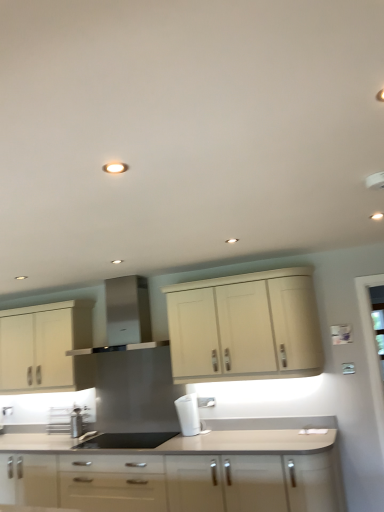
Question: Is black matte sink at center bigger than metallic stainless steel spice rack at lower left?

Choices:
 (A) no
 (B) yes

Answer: (B)

Question: Is black matte sink at center smaller than metallic stainless steel spice rack at lower left?

Choices:
 (A) no
 (B) yes

Answer: (A)

Question: From the image's perspective, is black matte sink at center below metallic stainless steel spice rack at lower left?

Choices:
 (A) no
 (B) yes

Answer: (A)

Question: Is metallic stainless steel spice rack at lower left at the back of black matte sink at center?

Choices:
 (A) no
 (B) yes

Answer: (A)

Question: Is black matte sink at center at the right side of metallic stainless steel spice rack at lower left?

Choices:
 (A) no
 (B) yes

Answer: (B)

Question: Considering the relative sizes of black matte sink at center and metallic stainless steel spice rack at lower left in the image provided, is black matte sink at center thinner than metallic stainless steel spice rack at lower left?

Choices:
 (A) no
 (B) yes

Answer: (A)

Question: From the image's perspective, is metallic stainless steel spice rack at lower left located above black matte sink at center?

Choices:
 (A) yes
 (B) no

Answer: (B)

Question: Does metallic stainless steel spice rack at lower left have a greater width compared to black matte sink at center?

Choices:
 (A) yes
 (B) no

Answer: (B)

Question: Is metallic stainless steel spice rack at lower left bigger than black matte sink at center?

Choices:
 (A) no
 (B) yes

Answer: (A)

Question: Is metallic stainless steel spice rack at lower left shorter than black matte sink at center?

Choices:
 (A) no
 (B) yes

Answer: (A)

Question: Can you confirm if metallic stainless steel spice rack at lower left is taller than black matte sink at center?

Choices:
 (A) yes
 (B) no

Answer: (A)

Question: From the image's perspective, is metallic stainless steel spice rack at lower left under black matte sink at center?

Choices:
 (A) no
 (B) yes

Answer: (B)

Question: Is matte white cabinets at center, marked as the third cabinetry in a top-to-bottom arrangement, completely or partially outside of stainless steel range hood at center?

Choices:
 (A) no
 (B) yes

Answer: (B)